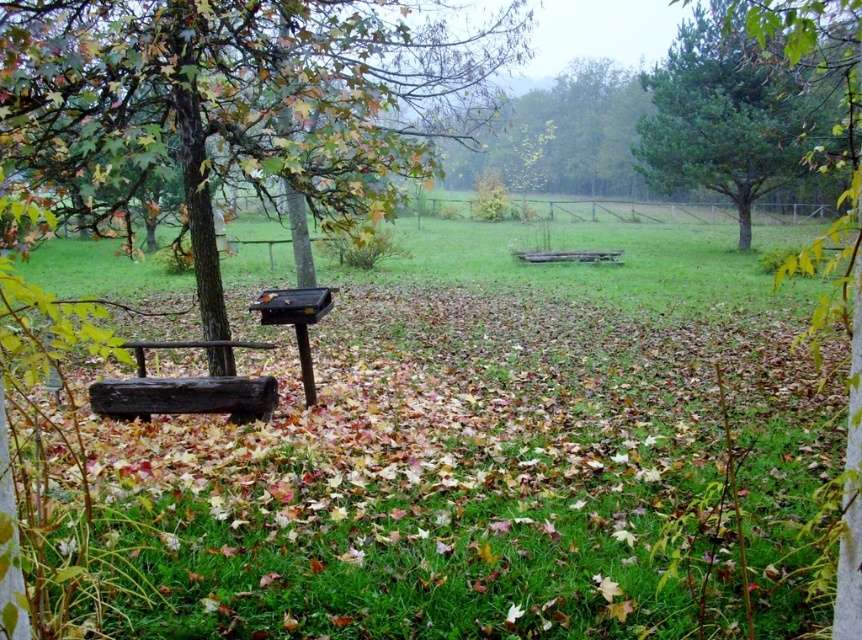
Who is higher up, brown textured tree trunk at left or green pine tree at upper right?

green pine tree at upper right is higher up.

Describe the element at coordinates (242, 100) in the screenshot. I see `brown textured tree trunk at left` at that location.

Is point (194, 28) less distant than point (828, 26)?

Yes, point (194, 28) is closer to viewer.

Image resolution: width=862 pixels, height=640 pixels. I want to click on brown textured tree trunk at left, so click(x=242, y=100).

Between green pine tree at upper right and dark brown wooden bench at left, which one appears on the right side from the viewer's perspective?

green pine tree at upper right is more to the right.

Is green pine tree at upper right closer to the viewer compared to dark brown wooden bench at left?

Yes, it is.

Is point (779, 29) positioned behind point (132, 342)?

No.

Locate an element on the screen. This screenshot has width=862, height=640. green pine tree at upper right is located at coordinates (753, 100).

Can you confirm if brown textured tree trunk at left is positioned above dark brown wooden bench at left?

Indeed, brown textured tree trunk at left is positioned over dark brown wooden bench at left.

Which of these two, brown textured tree trunk at left or dark brown wooden bench at left, stands taller?

brown textured tree trunk at left

The image size is (862, 640). What are the coordinates of `brown textured tree trunk at left` in the screenshot? It's located at (242, 100).

Where is `brown textured tree trunk at left`? brown textured tree trunk at left is located at coordinates (242, 100).